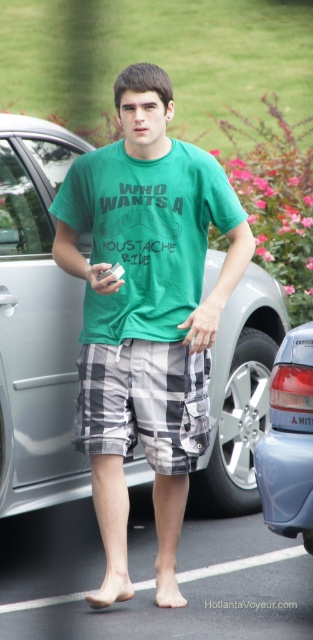
You are trying to locate the plaid cotton shorts at center in the image. According to the scene description, where would you expect to find them?

The plaid cotton shorts at center are located at point (143, 403) in the image coordinates.

You are standing in the parking lot and want to place a small flag exactly halfway between point (49, 364) and point (121, 145). Which direction should you move from the closer point to reach the halfway point?

The halfway point between point (49, 364) and point (121, 145) is located at the average of their coordinates. Since point (49, 364) is closer to the viewer, you should move towards the direction of point (121, 145) to reach the halfway point.